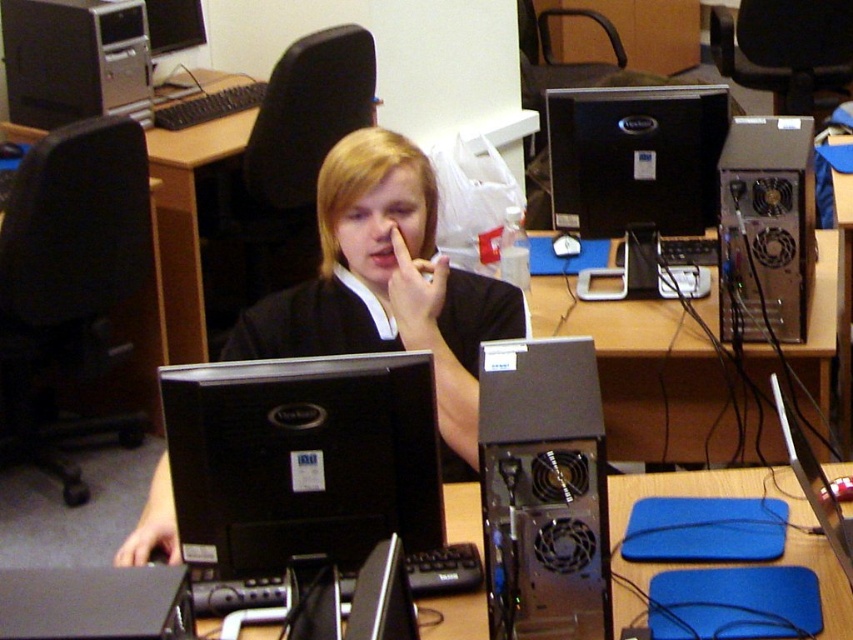
Is silver metallic tower at right to the right of silver metallic desktop at upper left from the viewer's perspective?

Yes, silver metallic tower at right is to the right of silver metallic desktop at upper left.

Which is in front, point (798, 186) or point (107, 88)?

Positioned in front is point (798, 186).

Identify the location of silver metallic tower at right. (764, 228).

From the picture: Between metallic silver computer case at center-right and silver metallic desktop at upper left, which one appears on the right side from the viewer's perspective?

Positioned to the right is metallic silver computer case at center-right.

The image size is (853, 640). In order to click on metallic silver computer case at center-right in this screenshot , I will do `click(651, 376)`.

Identify the location of metallic silver computer case at center-right. The width and height of the screenshot is (853, 640). (651, 376).

Can you confirm if black plastic computer tower at center is positioned to the right of metallic silver computer case at center-right?

No, black plastic computer tower at center is not to the right of metallic silver computer case at center-right.

Is black plastic computer tower at center smaller than metallic silver computer case at center-right?

Indeed, black plastic computer tower at center has a smaller size compared to metallic silver computer case at center-right.

The width and height of the screenshot is (853, 640). I want to click on black plastic computer tower at center, so click(x=543, y=490).